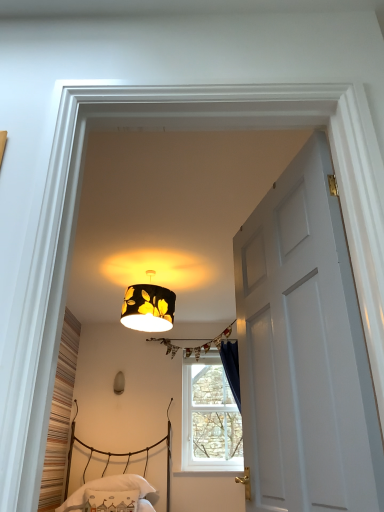
Question: Is white plastic window at center thinner than black fabric lampshade at center, the second lamp positioned from the left?

Choices:
 (A) yes
 (B) no

Answer: (A)

Question: Does white plastic window at center appear on the left side of black fabric lampshade at center, positioned as the 1th lamp in right-to-left order?

Choices:
 (A) yes
 (B) no

Answer: (B)

Question: Is white plastic window at center wider than black fabric lampshade at center, the 1th lamp positioned from the top?

Choices:
 (A) no
 (B) yes

Answer: (A)

Question: Is white plastic window at center at the right side of black fabric lampshade at center, the 1th lamp positioned from the top?

Choices:
 (A) yes
 (B) no

Answer: (A)

Question: Can you confirm if white plastic window at center is shorter than black fabric lampshade at center, the 2th lamp when ordered from bottom to top?

Choices:
 (A) yes
 (B) no

Answer: (B)

Question: From the image's perspective, is white plastic window at center on top of black fabric lampshade at center, marked as the first lamp in a front-to-back arrangement?

Choices:
 (A) yes
 (B) no

Answer: (B)

Question: Is white glossy door at center positioned before matte yellow fabric lampshade at upper center, which is the second lamp in front-to-back order?

Choices:
 (A) yes
 (B) no

Answer: (A)

Question: From the image's perspective, is white glossy door at center beneath matte yellow fabric lampshade at upper center, which is the first lamp from back to front?

Choices:
 (A) yes
 (B) no

Answer: (B)

Question: From a real-world perspective, is white glossy door at center located beneath matte yellow fabric lampshade at upper center, which is the first lamp from bottom to top?

Choices:
 (A) no
 (B) yes

Answer: (B)

Question: Is white glossy door at center bigger than matte yellow fabric lampshade at upper center, which is counted as the 2th lamp, starting from the right?

Choices:
 (A) no
 (B) yes

Answer: (B)

Question: Is matte yellow fabric lampshade at upper center, which is counted as the 2th lamp, starting from the right, completely or partially inside white glossy door at center?

Choices:
 (A) yes
 (B) no

Answer: (B)

Question: Does white glossy door at center have a greater width compared to matte yellow fabric lampshade at upper center, which is the second lamp in front-to-back order?

Choices:
 (A) yes
 (B) no

Answer: (A)

Question: Is the position of white plastic window at center more distant than that of white fabric pillow at lower center?

Choices:
 (A) no
 (B) yes

Answer: (B)